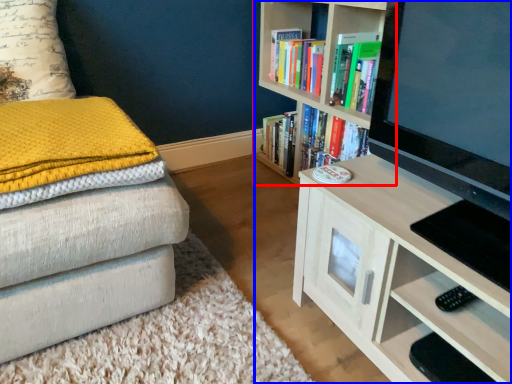
Question: Among these objects, which one is farthest to the camera, bookcase (highlighted by a red box) or bookcase (highlighted by a blue box)?

Choices:
 (A) bookcase
 (B) bookcase

Answer: (A)